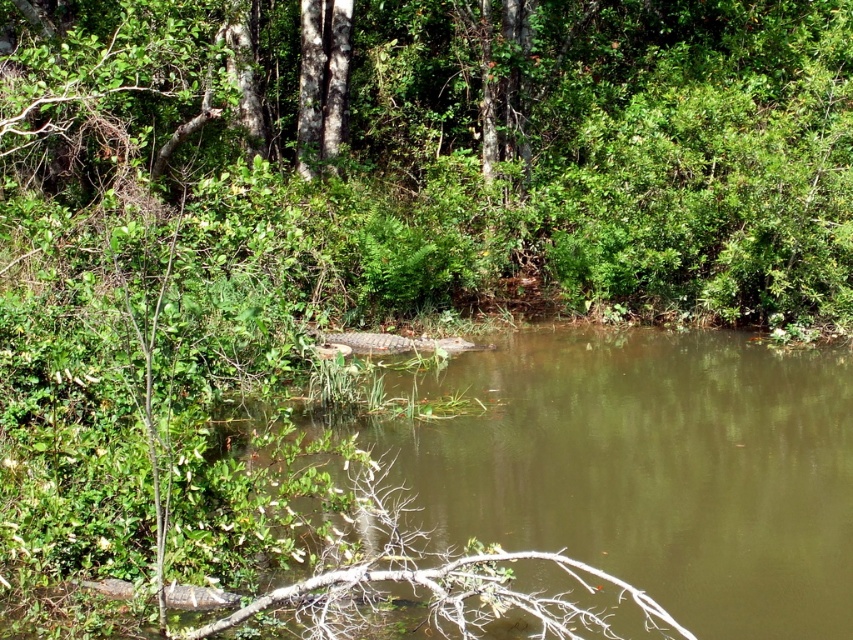
Consider the image. You are standing at the point marked by the coordinates point (469, 141) in the image. What object are you directly facing?

You are directly facing the green leafy tree at center, which is represented by the coordinates point (469, 141).

You are standing in a natural area and see the green leafy tree at center. If you want to take a photo of it from a distance of exactly 8 meters, should you move closer or farther away?

The green leafy tree at center is currently 7.62 meters away. To achieve an 8 meter distance, you need to move slightly farther away from the tree.